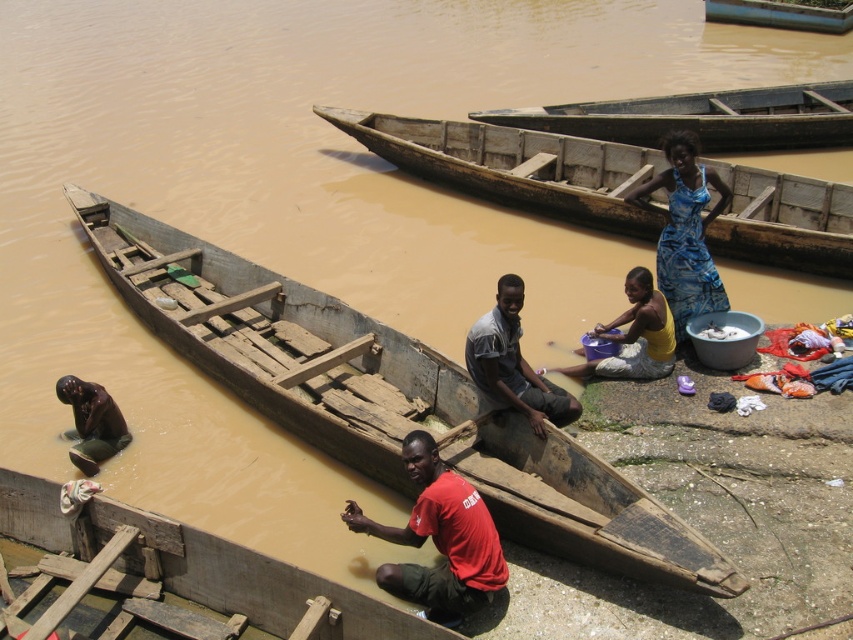
You are standing on the riverbank and want to throw a lifebuoy to someone in the wooden canoe at lower center. The lifebuoy can travel 8 feet. Will it reach the gray fabric shirt at center?

The wooden canoe at lower center is 8.28 feet from gray fabric shirt at center. Since the lifebuoy can travel 8 feet, it will not reach the gray fabric shirt at center as the distance is slightly longer than the lifebuoy can travel.

You are standing on the riverbank and want to choose a boat to cross the river. The wooden canoe at center and the gray fabric shirt at center are your options. Which one is smaller in size and thus easier to maneuver?

The wooden canoe at center is smaller in size compared to the gray fabric shirt at center, making it easier to maneuver.